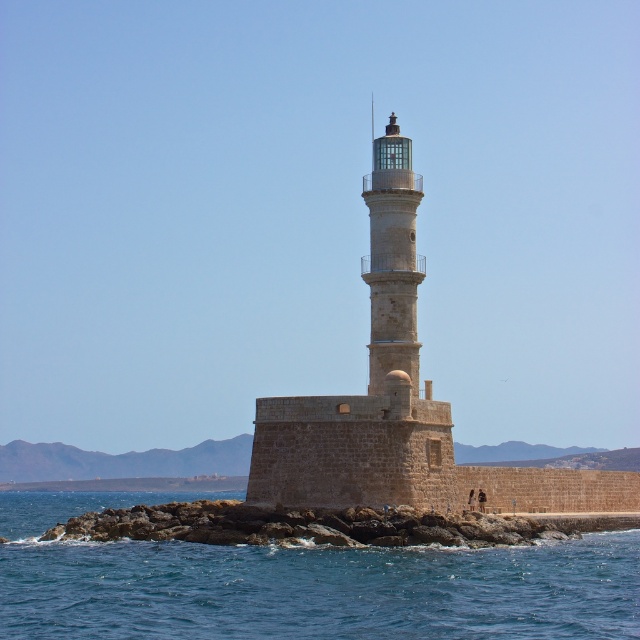
You are standing at the base of the lighthouse looking towards the sea. There are two points marked on the lighthouse structure. Which of the two points, point (x=588, y=572) or point (x=388, y=246), is closer to your current position?

Point (x=588, y=572) is closer to the camera than point (x=388, y=246), so it is closer to your current position.

You are a bird flying over the sea and want to land on the tallest structure in the image. Which one should you choose between the beige stone lighthouse at center and the smooth stone lighthouse at center?

The beige stone lighthouse at center is much taller than the smooth stone lighthouse at center, so the bird should choose the beige stone lighthouse at center to land on the tallest structure.

You are a photographer planning to capture the entire scene of the beige stone lighthouse at center and the blue water at lower left. Which object will occupy more space in your photo?

The blue water at lower left is bigger than the beige stone lighthouse at center, so it will occupy more space in the photo.